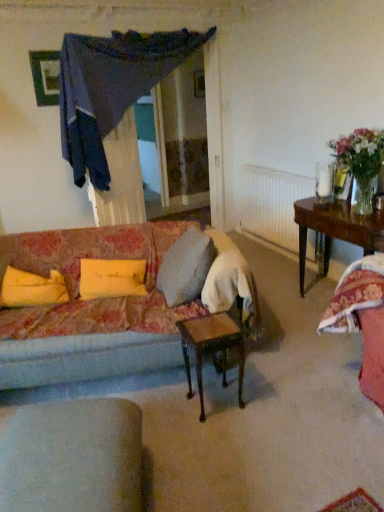
In order to face white textured radiator at center, should I rotate leftwards or rightwards?

You should rotate right by 11.528 degrees.

The width and height of the screenshot is (384, 512). What do you see at coordinates (91, 340) in the screenshot? I see `floral fabric couch at center` at bounding box center [91, 340].

Where is `brown wooden table at right, placed as the 2th table when sorted from left to right`? Image resolution: width=384 pixels, height=512 pixels. brown wooden table at right, placed as the 2th table when sorted from left to right is located at coordinates (336, 229).

The width and height of the screenshot is (384, 512). Describe the element at coordinates (363, 195) in the screenshot. I see `clear glass vase at right` at that location.

Locate an element on the screen. wooden table at center, the first table viewed from the left is located at coordinates (212, 346).

The height and width of the screenshot is (512, 384). What do you see at coordinates (212, 346) in the screenshot?
I see `wooden table at center, the first table viewed from the left` at bounding box center [212, 346].

Identify the location of white textured radiator at center. (272, 204).

Is light gray fabric chair at lower left completely or partially inside yellow fabric pillow at center, acting as the first pillow starting from the right?

No, light gray fabric chair at lower left is located outside of yellow fabric pillow at center, acting as the first pillow starting from the right.

Is yellow fabric pillow at center, the 2th pillow positioned from the left, far away from light gray fabric chair at lower left?

Yes, yellow fabric pillow at center, the 2th pillow positioned from the left, and light gray fabric chair at lower left are quite far apart.

In the scene shown: Considering the sizes of objects yellow fabric pillow at center, acting as the first pillow starting from the right, and light gray fabric chair at lower left in the image provided, who is bigger, yellow fabric pillow at center, acting as the first pillow starting from the right, or light gray fabric chair at lower left?

light gray fabric chair at lower left.

Find the location of `the 1st pillow behind the light gray fabric chair at lower left, starting your count from the anchor`. the 1st pillow behind the light gray fabric chair at lower left, starting your count from the anchor is located at coordinates (111, 278).

Is floral fabric couch at center in contact with yellow fabric pillow at center, acting as the first pillow starting from the right?

No.

Is floral fabric couch at center further to camera compared to yellow fabric pillow at center, the 2th pillow positioned from the left?

No, floral fabric couch at center is closer to the camera.

Who is taller, floral fabric couch at center or yellow fabric pillow at center, acting as the first pillow starting from the right?

floral fabric couch at center is taller.

Considering the sizes of objects floral fabric couch at center and yellow fabric pillow at center, acting as the first pillow starting from the right, in the image provided, who is wider, floral fabric couch at center or yellow fabric pillow at center, acting as the first pillow starting from the right,?

Wider between the two is floral fabric couch at center.

Considering the relative sizes of translucent glass vase at upper right and brown wooden table at right, placed as the 2th table when sorted from left to right, in the image provided, is translucent glass vase at upper right smaller than brown wooden table at right, placed as the 2th table when sorted from left to right,?

Indeed, translucent glass vase at upper right has a smaller size compared to brown wooden table at right, placed as the 2th table when sorted from left to right.

Is translucent glass vase at upper right next to brown wooden table at right, the first table from the back, and touching it?

translucent glass vase at upper right and brown wooden table at right, the first table from the back, are clearly separated.

From a real-world perspective, is translucent glass vase at upper right physically below brown wooden table at right, the second table from the front?

No, from a real-world perspective, translucent glass vase at upper right is not below brown wooden table at right, the second table from the front.

Locate an element on the screen. curtain lying above the white textured radiator at center (from the image's perspective) is located at coordinates (111, 88).

Does dark blue fabric at upper center turn towards white textured radiator at center?

No, dark blue fabric at upper center is not aimed at white textured radiator at center.

Is dark blue fabric at upper center placed right next to white textured radiator at center?

dark blue fabric at upper center is not next to white textured radiator at center, and they're not touching.

Consider the image. Between dark blue fabric at upper center and white textured radiator at center, which one is positioned in front?

Positioned in front is dark blue fabric at upper center.

Does yellow fabric pillow at left, arranged as the 2th pillow when viewed from the right, have a greater width compared to brown wooden table at right, the first table from the back?

Incorrect, the width of yellow fabric pillow at left, arranged as the 2th pillow when viewed from the right, does not surpass that of brown wooden table at right, the first table from the back.

Consider the image. From the image's perspective, relative to brown wooden table at right, the first table from the back, is yellow fabric pillow at left, acting as the 1th pillow starting from the left, above or below?

Based on their image positions, yellow fabric pillow at left, acting as the 1th pillow starting from the left, is located beneath brown wooden table at right, the first table from the back.

Which is more to the left, yellow fabric pillow at left, arranged as the 2th pillow when viewed from the right, or brown wooden table at right, the second table from the front?

From the viewer's perspective, yellow fabric pillow at left, arranged as the 2th pillow when viewed from the right, appears more on the left side.

Which of these two, floral fabric couch at center or wooden table at center, acting as the second table starting from the back, is bigger?

floral fabric couch at center is bigger.

Are floral fabric couch at center and wooden table at center, marked as the 1th table in a front-to-back arrangement, making contact?

There is a gap between floral fabric couch at center and wooden table at center, marked as the 1th table in a front-to-back arrangement.

Is floral fabric couch at center taller than wooden table at center, acting as the second table starting from the back?

Indeed, floral fabric couch at center has a greater height compared to wooden table at center, acting as the second table starting from the back.

Would you say wooden table at center, acting as the second table starting from the back, is part of floral fabric couch at center's contents?

No, wooden table at center, acting as the second table starting from the back, is located outside of floral fabric couch at center.

Does translucent glass vase at upper right have a smaller size compared to light gray fabric chair at lower left?

Correct, translucent glass vase at upper right occupies less space than light gray fabric chair at lower left.

Considering the points (366, 138) and (14, 502), which point is behind, point (366, 138) or point (14, 502)?

The point (366, 138) is more distant.

What's the angular difference between translucent glass vase at upper right and light gray fabric chair at lower left's facing directions?

They differ by 68.8 degrees in their facing directions.

Is translucent glass vase at upper right positioned beyond the bounds of light gray fabric chair at lower left?

Absolutely, translucent glass vase at upper right is external to light gray fabric chair at lower left.

In order to click on pillow that is the 1st object to the left of the light gray fabric chair at lower left, starting at the anchor in this screenshot , I will do `click(111, 278)`.

Locate an element on the screen. The image size is (384, 512). pillow that is on the right side of floral fabric couch at center is located at coordinates (111, 278).

Which object lies nearer to the anchor point white textured radiator at center, yellow fabric pillow at left, arranged as the 2th pillow when viewed from the right, or clear glass vase at right?

Based on the image, clear glass vase at right appears to be nearer to white textured radiator at center.

Looking at the image, which one is located further to translucent glass vase at upper right, clear glass vase at right or white textured radiator at center?

white textured radiator at center lies further to translucent glass vase at upper right than the other object.

From the image, which object appears to be farther from white textured radiator at center, translucent glass vase at upper right or light gray fabric chair at lower left?

light gray fabric chair at lower left lies further to white textured radiator at center than the other object.

Estimate the real-world distances between objects in this image. Which object is further from translucent glass vase at upper right, yellow fabric pillow at center, the 2th pillow positioned from the left, or brown wooden table at right, the second table from the front?

yellow fabric pillow at center, the 2th pillow positioned from the left, lies further to translucent glass vase at upper right than the other object.

Consider the image. When comparing their distances from yellow fabric pillow at left, acting as the 1th pillow starting from the left, does light gray fabric chair at lower left or dark blue fabric at upper center seem closer?

The object closer to yellow fabric pillow at left, acting as the 1th pillow starting from the left, is light gray fabric chair at lower left.

Considering their positions, is dark blue fabric at upper center positioned further to floral fabric couch at center than clear glass vase at right?

clear glass vase at right lies further to floral fabric couch at center than the other object.

From the picture: Based on their spatial positions, is clear glass vase at right or dark blue fabric at upper center closer to yellow fabric pillow at left, acting as the 1th pillow starting from the left?

dark blue fabric at upper center lies closer to yellow fabric pillow at left, acting as the 1th pillow starting from the left, than the other object.

Considering their positions, is wooden table at center, acting as the second table starting from the back, positioned closer to dark blue fabric at upper center than yellow fabric pillow at center, the 2th pillow positioned from the left?

yellow fabric pillow at center, the 2th pillow positioned from the left, is positioned closer to the anchor dark blue fabric at upper center.

Identify the location of table located between yellow fabric pillow at left, arranged as the 2th pillow when viewed from the right, and white textured radiator at center in the left-right direction. This screenshot has height=512, width=384. (212, 346).

The width and height of the screenshot is (384, 512). Identify the location of radiator situated between dark blue fabric at upper center and brown wooden table at right, the first table from the back, from left to right. (272, 204).

Image resolution: width=384 pixels, height=512 pixels. What are the coordinates of `studio couch between yellow fabric pillow at left, arranged as the 2th pillow when viewed from the right, and translucent glass vase at upper right` in the screenshot? It's located at (91, 340).

Where is `chair between yellow fabric pillow at left, arranged as the 2th pillow when viewed from the right, and clear glass vase at right from left to right`? Image resolution: width=384 pixels, height=512 pixels. chair between yellow fabric pillow at left, arranged as the 2th pillow when viewed from the right, and clear glass vase at right from left to right is located at coordinates (72, 457).